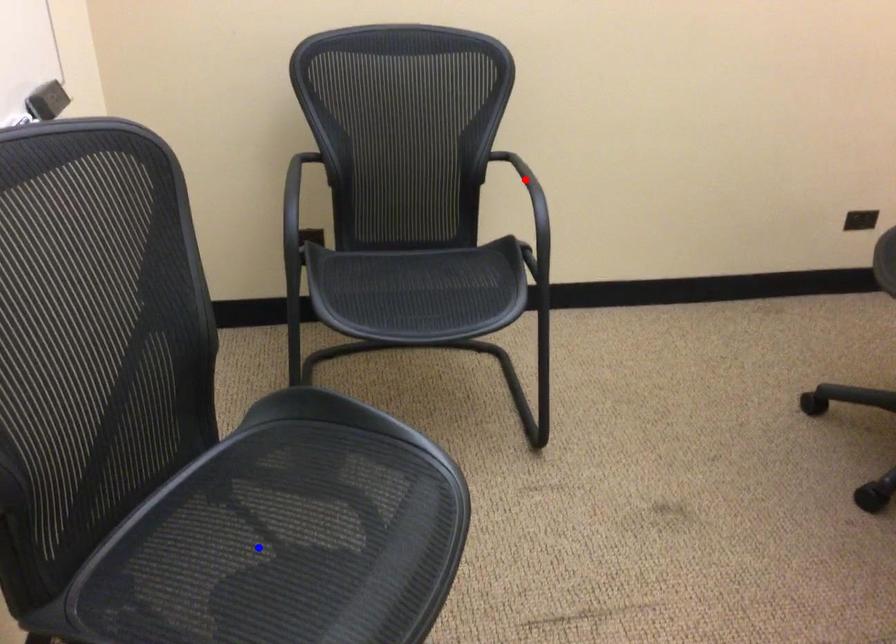
Question: Two points are marked on the image. Which point is closer to the camera?

Choices:
 (A) Blue point is closer.
 (B) Red point is closer.

Answer: (A)